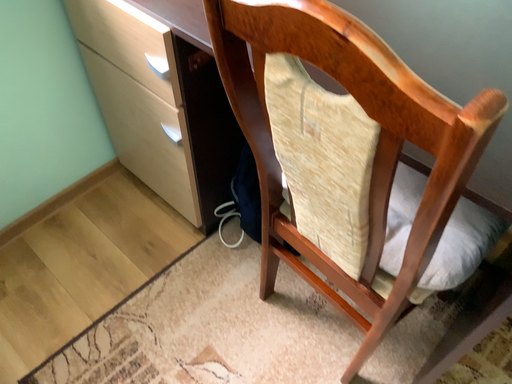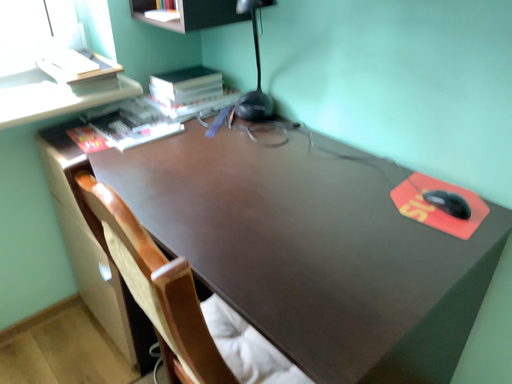
Question: Which way did the camera rotate in the video?

Choices:
 (A) rotated downward
 (B) rotated upward

Answer: (B)